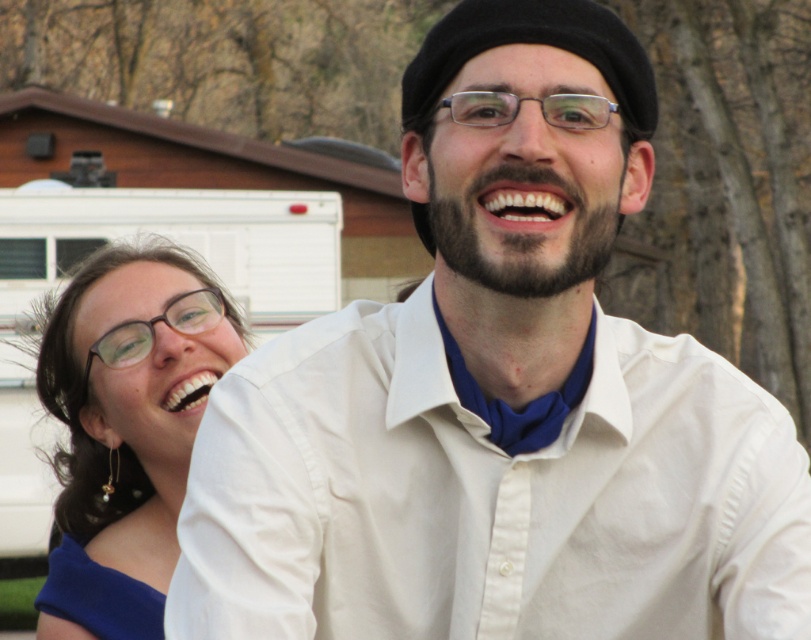
Does blue fabric dress at left appear on the right side of clear plastic glasses at center?

No, blue fabric dress at left is not to the right of clear plastic glasses at center.

Measure the distance between blue fabric dress at left and clear plastic glasses at center.

blue fabric dress at left and clear plastic glasses at center are 3.09 meters apart.

Is point (172, 429) closer to camera compared to point (494, 124)?

No.

Identify the location of blue fabric dress at left. This screenshot has height=640, width=811. (127, 428).

Is point (78, 600) less distant than point (554, 120)?

No, (78, 600) is further to viewer.

This screenshot has height=640, width=811. What do you see at coordinates (97, 595) in the screenshot?
I see `blue fabric dress at lower left` at bounding box center [97, 595].

Identify the location of blue fabric dress at lower left. (97, 595).

Based on the photo, does blue fabric dress at left have a lesser height compared to blue fabric dress at lower left?

In fact, blue fabric dress at left may be taller than blue fabric dress at lower left.

Who is positioned more to the left, blue fabric dress at left or blue fabric dress at lower left?

From the viewer's perspective, blue fabric dress at lower left appears more on the left side.

Between point (191, 324) and point (101, 618), which one is positioned in front?

Point (101, 618) is more forward.

Find the location of a particular element. blue fabric dress at left is located at coordinates (127, 428).